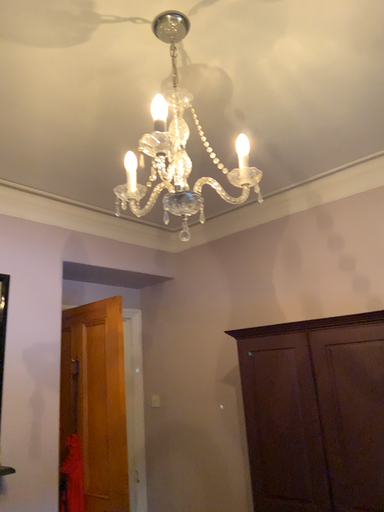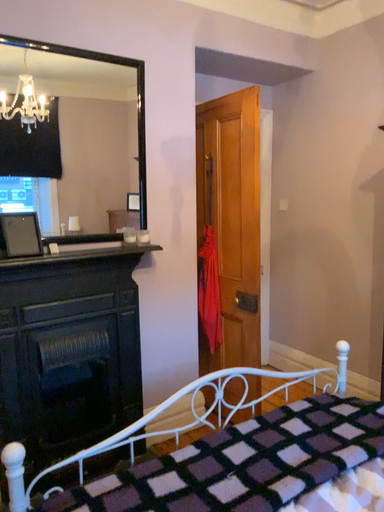
Question: How did the camera likely rotate when shooting the video?

Choices:
 (A) rotated upward
 (B) rotated downward

Answer: (B)